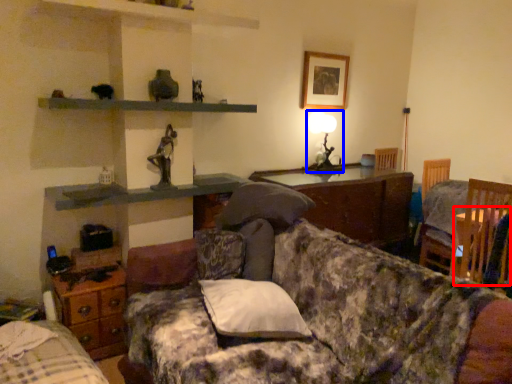
Question: Which object appears closest to the camera in this image, table (highlighted by a red box) or table lamp (highlighted by a blue box)?

Choices:
 (A) table
 (B) table lamp

Answer: (A)